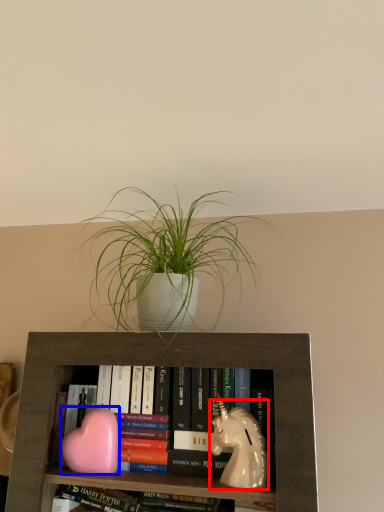
Question: Which of the following is the farthest to the observer, animal (highlighted by a red box) or animal (highlighted by a blue box)?

Choices:
 (A) animal
 (B) animal

Answer: (B)